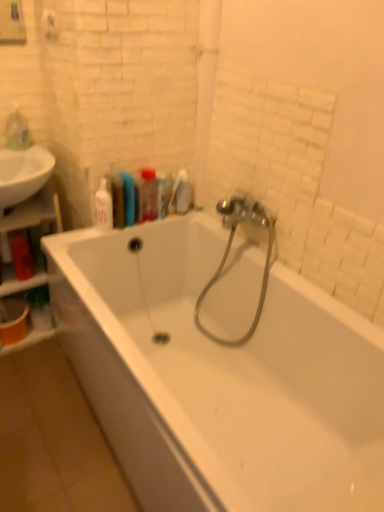
Question: Is white matte towel bar at upper left inside or outside of wooden shelf at left?

Choices:
 (A) inside
 (B) outside

Answer: (B)

Question: Is point (43, 27) closer or farther from the camera than point (54, 199)?

Choices:
 (A) closer
 (B) farther

Answer: (A)

Question: Based on their relative distances, which object is nearer to the white glossy soap dispenser at upper left, which is the 3th toiletry from right to left?

Choices:
 (A) wooden shelf at left
 (B) translucent plastic bottle at upper center, marked as the 2th toiletry in a right-to-left arrangement
 (C) white glossy sink at left
 (D) translucent plastic bag at upper left, marked as the first toiletry in a left-to-right arrangement
 (E) white glossy bathtub at center

Answer: (B)

Question: Considering the real-world distances, which object is farthest from the translucent plastic bottle at upper center, marked as the third toiletry in a left-to-right arrangement?

Choices:
 (A) white glossy sink at left
 (B) metallic silver garden hose at center
 (C) white glossy soap dispenser at upper left, which is the 3th toiletry from right to left
 (D) translucent plastic toothbrush at upper center, which is the 4th toiletry from left to right
 (E) wooden shelf at left

Answer: (E)